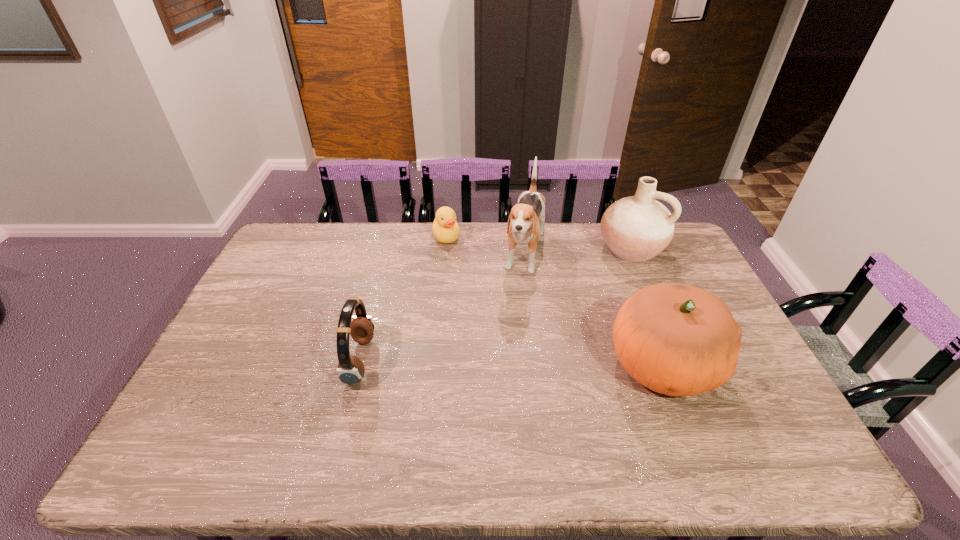
Find the location of `vacant space in between the headset and the fourth object from right to left`. vacant space in between the headset and the fourth object from right to left is located at coordinates (403, 298).

Locate an element on the screen. The image size is (960, 540). vacant space that is in between the third object from right to left and the headset is located at coordinates (443, 308).

Identify the location of unoccupied area between the duck and the puppy. This screenshot has width=960, height=540. (486, 246).

In order to click on unoccupied area between the pumpkin and the duck in this screenshot , I will do `click(554, 300)`.

You are a GUI agent. You are given a task and a screenshot of the screen. Output one action in this format:
    pyautogui.click(x=<x>, y=<y>)
    Task: Click on the vacant area that lies between the leftmost object and the pottery
    The width and height of the screenshot is (960, 540).
    Given the screenshot: What is the action you would take?
    pyautogui.click(x=495, y=305)

Locate an element on the screen. This screenshot has width=960, height=540. free point between the pumpkin and the fourth object from right to left is located at coordinates click(554, 300).

In order to click on free space between the leftmost object and the puppy in this screenshot , I will do `click(443, 308)`.

The width and height of the screenshot is (960, 540). What are the coordinates of `free spot between the pottery and the fourth object from right to left` in the screenshot? It's located at (539, 242).

Locate an element on the screen. vacant area that lies between the leftmost object and the puppy is located at coordinates (443, 308).

At what (x,y) coordinates should I click in order to perform the action: click on free space between the pottery and the third object from right to left. Please return your answer as a coordinate pair (x, y). This screenshot has height=540, width=960. Looking at the image, I should click on (579, 252).